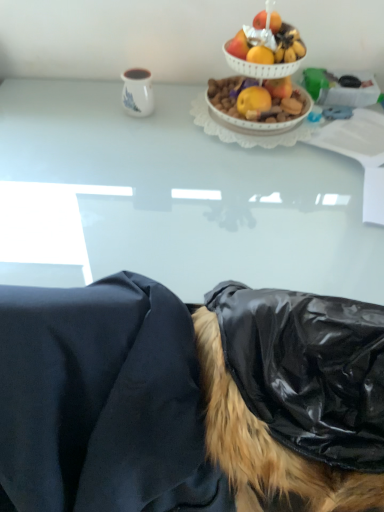
Find the location of a particular element. The width and height of the screenshot is (384, 512). vacant space that's between white ceramic mug at upper center and shiny white bowl at upper center is located at coordinates (178, 113).